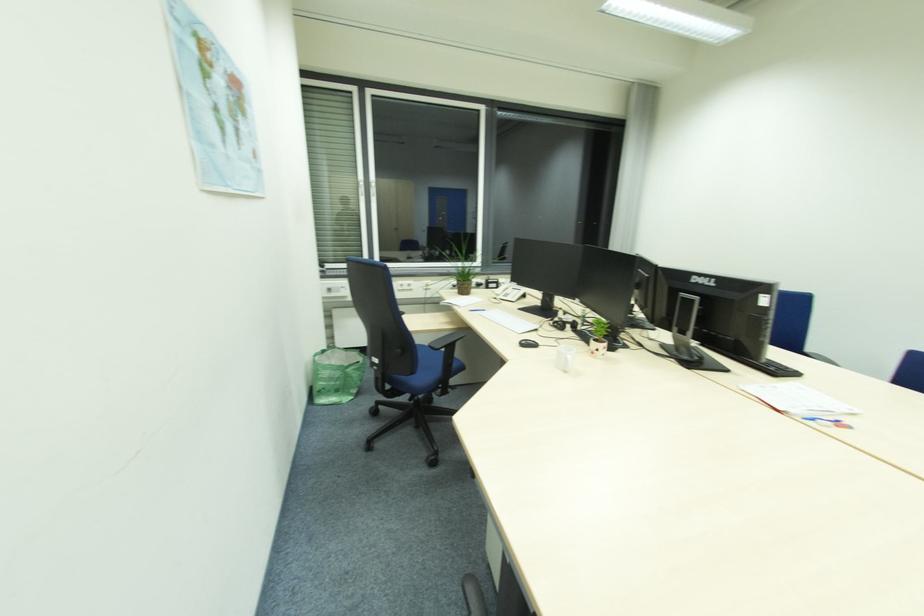
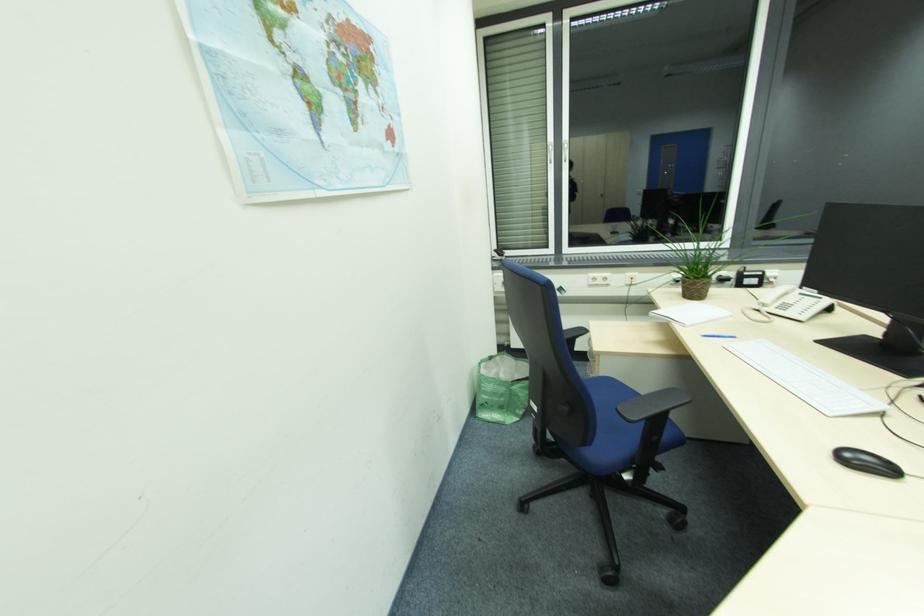
Question: The camera is either moving clockwise (left) or counter-clockwise (right) around the object. The first image is from the beginning of the video and the second image is from the end. Is the camera moving left or right when shooting the video?

Choices:
 (A) Left
 (B) Right

Answer: (B)